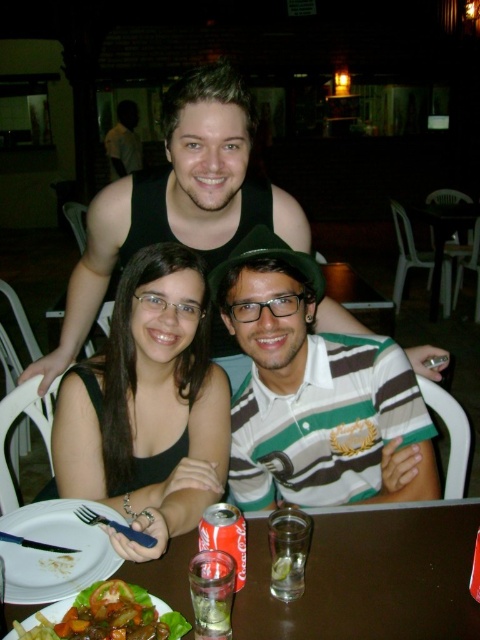
You are a waiter at the restaurant and need to deliver a drink to the person wearing the black matte tank top at center. The drink is currently on the white matte plate at lower left. Can you easily slide the drink forward to the person without moving the plate?

The white matte plate at lower left is behind the black matte tank top at center, so the drink on the white matte plate at lower left cannot be easily slid forward to the person wearing the black matte tank top at center without moving the plate.

You are a photographer trying to capture a closeup of the black matte tank top at center and the white matte plate at lower left. Since you want both items to appear the same size in the photo, which object should you move closer to the camera?

The white matte plate at lower left should be moved closer to the camera because the black matte tank top at center is larger in size and will appear bigger even from a distance.